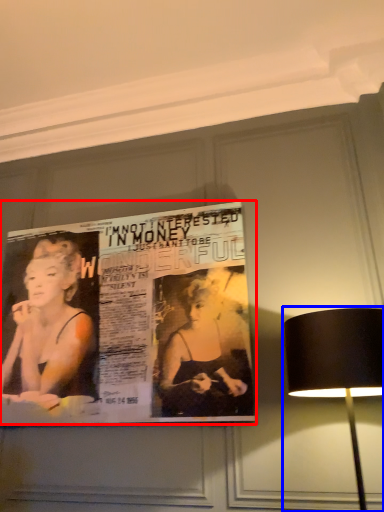
Question: Among these objects, which one is nearest to the camera, poster (highlighted by a red box) or lamp (highlighted by a blue box)?

Choices:
 (A) poster
 (B) lamp

Answer: (B)